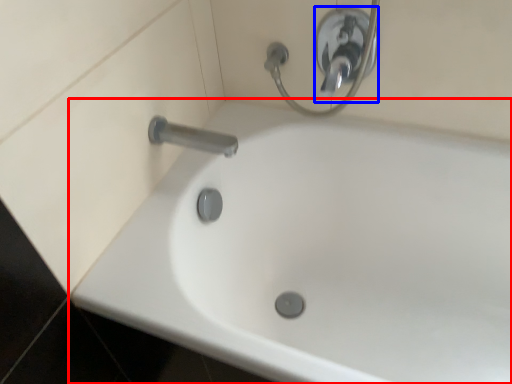
Question: Which object is further to the camera taking this photo, bathtub (highlighted by a red box) or shower (highlighted by a blue box)?

Choices:
 (A) bathtub
 (B) shower

Answer: (B)